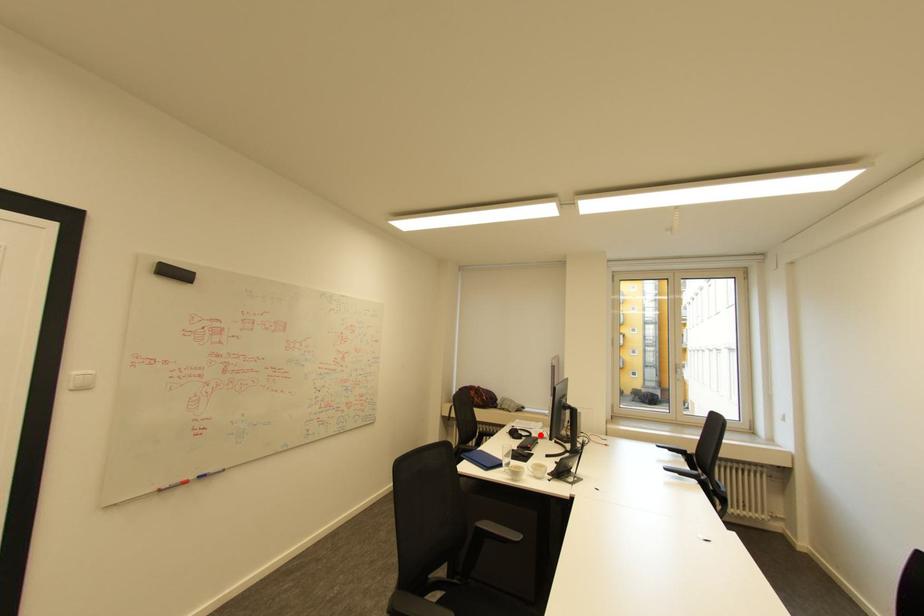
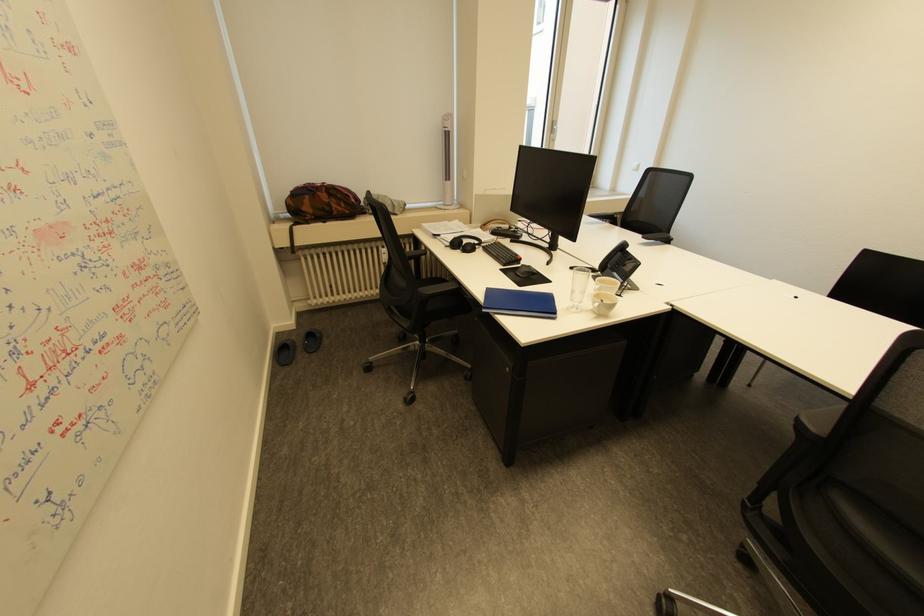
Question: I am providing you with two images of the same scene from different viewpoints. In image1, a red point is highlighted. Considering the same 3D point in image2, which of the following is correct?

Choices:
 (A) It is closer
 (B) It is farther

Answer: (A)